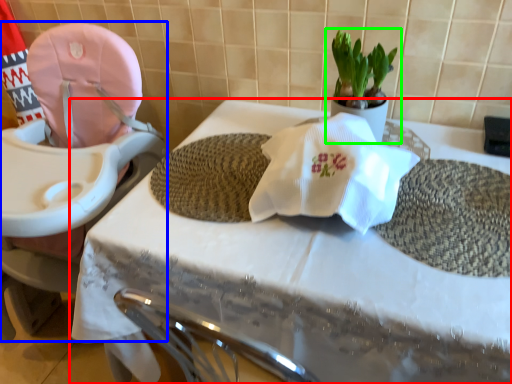
Question: Considering the real-world distances, which object is farthest from table (highlighted by a red box)? baby carriage (highlighted by a blue box) or houseplant (highlighted by a green box)?

Choices:
 (A) baby carriage
 (B) houseplant

Answer: (B)